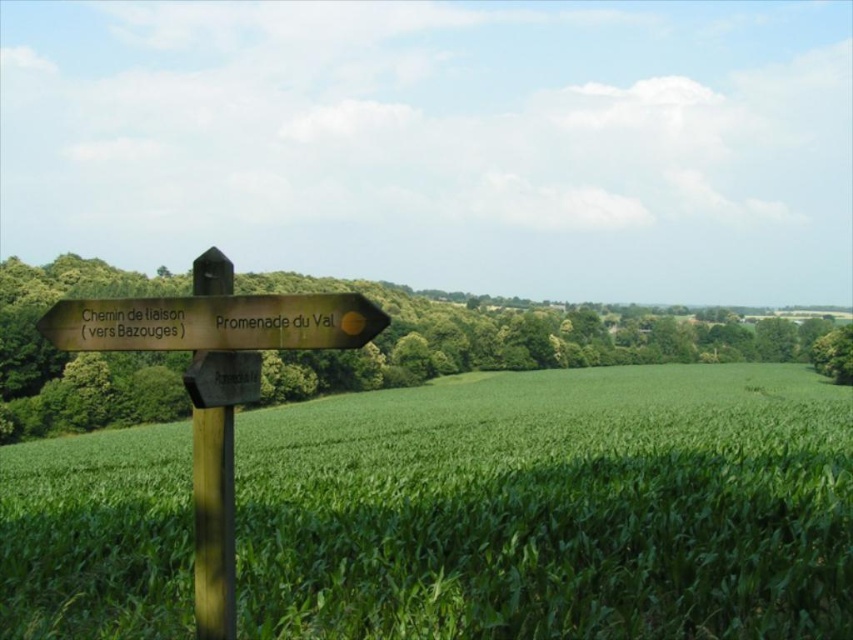
Who is more forward, [173,339] or [202,612]?

Point [202,612]

I want to click on wooden signpost at left, so click(215, 385).

I want to click on green grassy field at center, so click(x=552, y=508).

Which is in front, point (515, 445) or point (323, 314)?

Point (323, 314) is in front.

Find the location of `green grassy field at center`. green grassy field at center is located at coordinates (552, 508).

Does point (811, 500) come farther from viewer compared to point (213, 397)?

Yes, it is behind point (213, 397).

Who is higher up, green grassy field at center or wooden signpost at left?

Positioned higher is wooden signpost at left.

This screenshot has height=640, width=853. Find the location of `green grassy field at center`. green grassy field at center is located at coordinates (552, 508).

Locate an element on the screen. green grassy field at center is located at coordinates 552,508.